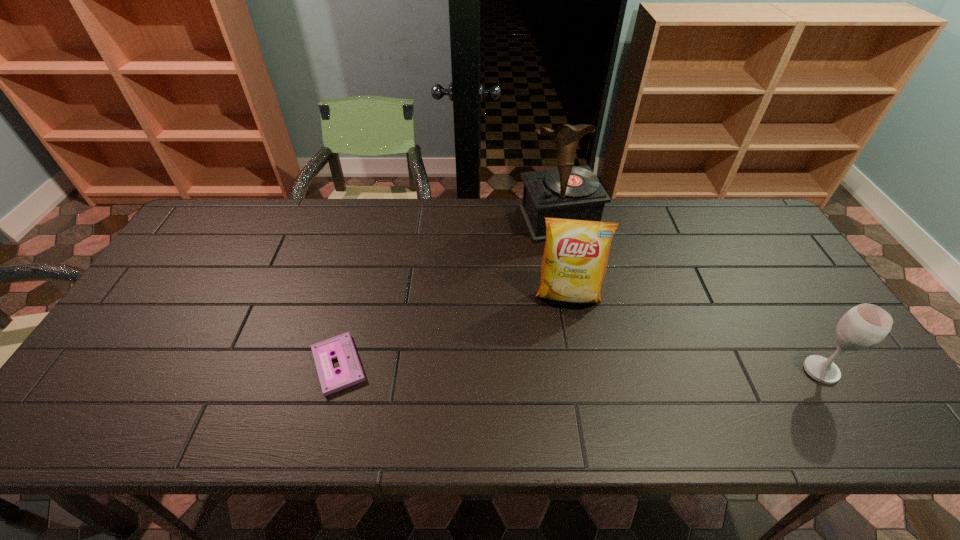
Find the location of a particular element. The width and height of the screenshot is (960, 540). vacant area at the near edge is located at coordinates (456, 389).

The height and width of the screenshot is (540, 960). I want to click on free space at the left edge, so click(x=166, y=289).

You are a GUI agent. You are given a task and a screenshot of the screen. Output one action in this format:
    pyautogui.click(x=<x>, y=<y>)
    Task: Click on the free region at the right edge
    The width and height of the screenshot is (960, 540).
    Given the screenshot: What is the action you would take?
    pyautogui.click(x=771, y=262)

Where is `empty space between the videotape and the farthest object`? empty space between the videotape and the farthest object is located at coordinates (448, 292).

Find the location of a particular element. free space between the leftmost object and the phonograph_record is located at coordinates (448, 292).

Where is `vacant space that's between the phonograph_record and the wineglass`? vacant space that's between the phonograph_record and the wineglass is located at coordinates (689, 295).

Identify the location of free point between the third tallest object and the third nearest object. The width and height of the screenshot is (960, 540). (694, 333).

Locate an element on the screen. This screenshot has width=960, height=540. vacant space in between the shortest object and the third tallest object is located at coordinates (580, 367).

Identify the location of free space between the phonograph_record and the leftmost object. tap(448, 292).

Locate an element on the screen. This screenshot has height=540, width=960. free space between the videotape and the phonograph_record is located at coordinates (448, 292).